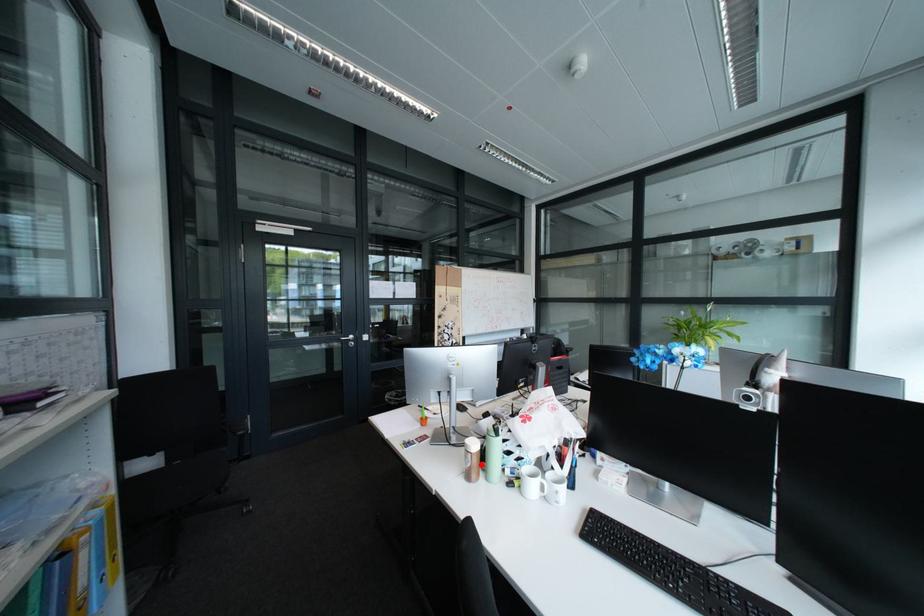
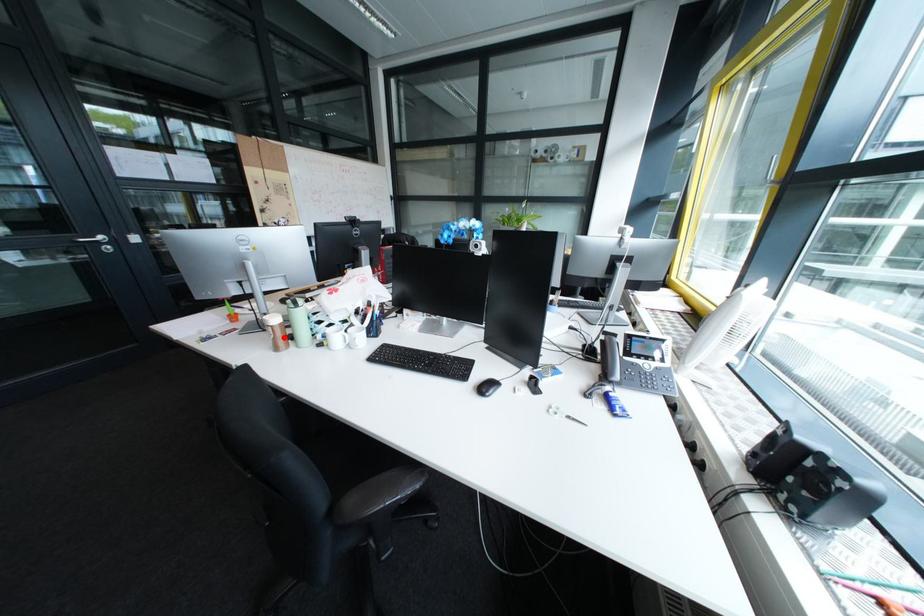
I am providing you with two images of the same scene from different viewpoints. A red point is marked on the first image and another point is marked on the second image. Is the marked point in image1 the same physical position as the marked point in image2?

Yes